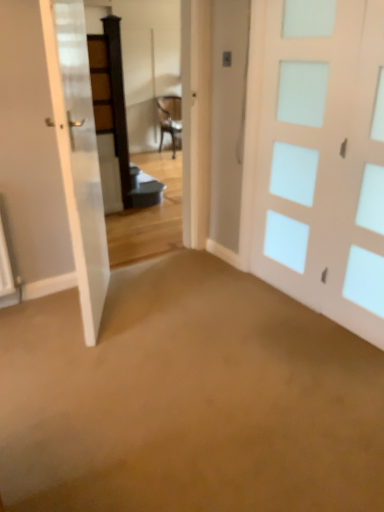
You are a GUI agent. You are given a task and a screenshot of the screen. Output one action in this format:
    pyautogui.click(x=<x>, y=<y>)
    Task: Click on the white frosted glass door at right, the 1th door from the right
    The image size is (384, 512).
    Given the screenshot: What is the action you would take?
    pyautogui.click(x=323, y=160)

What do you see at coordinates (323, 160) in the screenshot? The height and width of the screenshot is (512, 384). I see `white frosted glass door at right, the second door from the left` at bounding box center [323, 160].

Locate an element on the screen. The image size is (384, 512). white glossy door at left, which is the 1th door in left-to-right order is located at coordinates (51, 155).

Describe the element at coordinates (51, 155) in the screenshot. Image resolution: width=384 pixels, height=512 pixels. I see `white glossy door at left, arranged as the second door when viewed from the right` at that location.

This screenshot has width=384, height=512. I want to click on white frosted glass door at right, the 1th door from the right, so click(323, 160).

Considering the positions of objects white glossy door at left, which is the 1th door in left-to-right order, and white frosted glass door at right, the 1th door from the right, in the image provided, who is more to the right, white glossy door at left, which is the 1th door in left-to-right order, or white frosted glass door at right, the 1th door from the right,?

From the viewer's perspective, white frosted glass door at right, the 1th door from the right, appears more on the right side.

Consider the image. Considering the relative positions of white glossy door at left, which is the 1th door in left-to-right order, and white frosted glass door at right, the second door from the left, in the image provided, is white glossy door at left, which is the 1th door in left-to-right order, behind white frosted glass door at right, the second door from the left,?

No, the depth of white glossy door at left, which is the 1th door in left-to-right order, is less than that of white frosted glass door at right, the second door from the left.

Which is behind, point (97, 189) or point (371, 273)?

Point (97, 189)

From the image's perspective, which one is positioned higher, white glossy door at left, arranged as the second door when viewed from the right, or white frosted glass door at right, the 1th door from the right?

From the image's view, white frosted glass door at right, the 1th door from the right, is above.

From a real-world perspective, is white glossy door at left, arranged as the second door when viewed from the right, positioned above or below white frosted glass door at right, the second door from the left?

Clearly, from a real-world perspective, white glossy door at left, arranged as the second door when viewed from the right, is below white frosted glass door at right, the second door from the left.

Which of these two, white glossy door at left, which is the 1th door in left-to-right order, or white frosted glass door at right, the second door from the left, is wider?

→ white glossy door at left, which is the 1th door in left-to-right order, is wider.

In terms of height, does white glossy door at left, which is the 1th door in left-to-right order, look taller or shorter compared to white frosted glass door at right, the second door from the left?

Considering their sizes, white glossy door at left, which is the 1th door in left-to-right order, has less height than white frosted glass door at right, the second door from the left.

Considering the sizes of white glossy door at left, which is the 1th door in left-to-right order, and white frosted glass door at right, the 1th door from the right, in the image, is white glossy door at left, which is the 1th door in left-to-right order, bigger or smaller than white frosted glass door at right, the 1th door from the right,?

Clearly, white glossy door at left, which is the 1th door in left-to-right order, is larger in size than white frosted glass door at right, the 1th door from the right.

Would you say white glossy door at left, which is the 1th door in left-to-right order, is outside white frosted glass door at right, the second door from the left?

That's correct, white glossy door at left, which is the 1th door in left-to-right order, is outside of white frosted glass door at right, the second door from the left.

Are white glossy door at left, arranged as the second door when viewed from the right, and white frosted glass door at right, the 1th door from the right, located far from each other?

white glossy door at left, arranged as the second door when viewed from the right, is far away from white frosted glass door at right, the 1th door from the right.

In the scene shown: Could you tell me if white glossy door at left, arranged as the second door when viewed from the right, is facing white frosted glass door at right, the second door from the left?

Yes.

The height and width of the screenshot is (512, 384). Find the location of `door that appears on the right of white glossy door at left, arranged as the second door when viewed from the right`. door that appears on the right of white glossy door at left, arranged as the second door when viewed from the right is located at coordinates (323, 160).

Which object is positioned more to the right, white frosted glass door at right, the 1th door from the right, or white glossy door at left, arranged as the second door when viewed from the right?

Positioned to the right is white frosted glass door at right, the 1th door from the right.

Is white frosted glass door at right, the 1th door from the right, positioned in front of white glossy door at left, arranged as the second door when viewed from the right?

No.

Is point (269, 260) closer to camera compared to point (5, 77)?

No, (269, 260) is behind (5, 77).

From the image's perspective, which one is positioned lower, white frosted glass door at right, the second door from the left, or white glossy door at left, which is the 1th door in left-to-right order?

white glossy door at left, which is the 1th door in left-to-right order, from the image's perspective.

From a real-world perspective, is white frosted glass door at right, the second door from the left, below white glossy door at left, arranged as the second door when viewed from the right?

No.

Considering the relative sizes of white frosted glass door at right, the 1th door from the right, and white glossy door at left, which is the 1th door in left-to-right order, in the image provided, is white frosted glass door at right, the 1th door from the right, wider than white glossy door at left, which is the 1th door in left-to-right order,?

Incorrect, the width of white frosted glass door at right, the 1th door from the right, does not surpass that of white glossy door at left, which is the 1th door in left-to-right order.

Can you confirm if white frosted glass door at right, the second door from the left, is shorter than white glossy door at left, which is the 1th door in left-to-right order?

No, white frosted glass door at right, the second door from the left, is not shorter than white glossy door at left, which is the 1th door in left-to-right order.

Does white frosted glass door at right, the 1th door from the right, have a smaller size compared to white glossy door at left, arranged as the second door when viewed from the right?

Correct, white frosted glass door at right, the 1th door from the right, occupies less space than white glossy door at left, arranged as the second door when viewed from the right.

Is white frosted glass door at right, the 1th door from the right, inside the boundaries of white glossy door at left, which is the 1th door in left-to-right order, or outside?

The correct answer is: outside.

Would you consider white frosted glass door at right, the second door from the left, to be distant from white glossy door at left, which is the 1th door in left-to-right order?

Yes.

Could you tell me if white frosted glass door at right, the 1th door from the right, is turned towards white glossy door at left, which is the 1th door in left-to-right order?

Yes.

Measure the distance between white frosted glass door at right, the 1th door from the right, and white glossy door at left, arranged as the second door when viewed from the right.

white frosted glass door at right, the 1th door from the right, and white glossy door at left, arranged as the second door when viewed from the right, are 4.43 feet apart from each other.

Where is `door above the white glossy door at left, which is the 1th door in left-to-right order (from the image's perspective)`? This screenshot has height=512, width=384. door above the white glossy door at left, which is the 1th door in left-to-right order (from the image's perspective) is located at coordinates (323, 160).

You are a GUI agent. You are given a task and a screenshot of the screen. Output one action in this format:
    pyautogui.click(x=<x>, y=<y>)
    Task: Click on the door to the right of white glossy door at left, which is the 1th door in left-to-right order
    The width and height of the screenshot is (384, 512).
    Given the screenshot: What is the action you would take?
    pyautogui.click(x=323, y=160)

This screenshot has height=512, width=384. Identify the location of door above the white glossy door at left, arranged as the second door when viewed from the right (from the image's perspective). (323, 160).